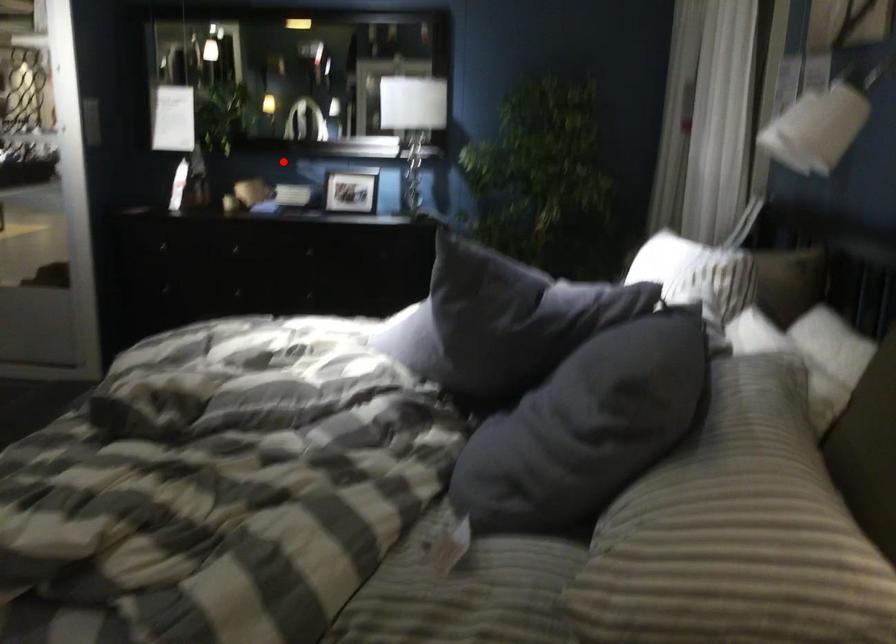
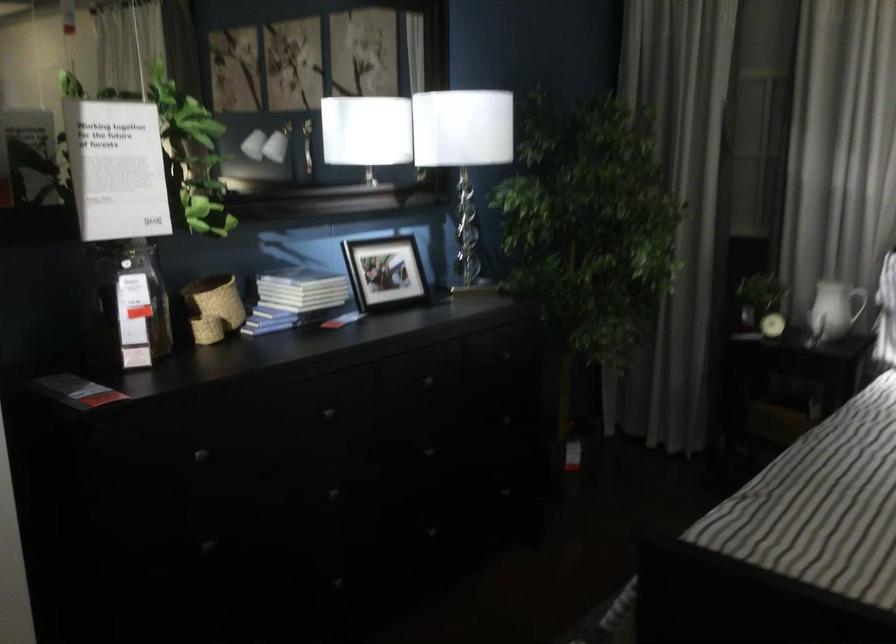
Find the pixel in the second image that matches the highlighted location in the first image.

(300, 290)